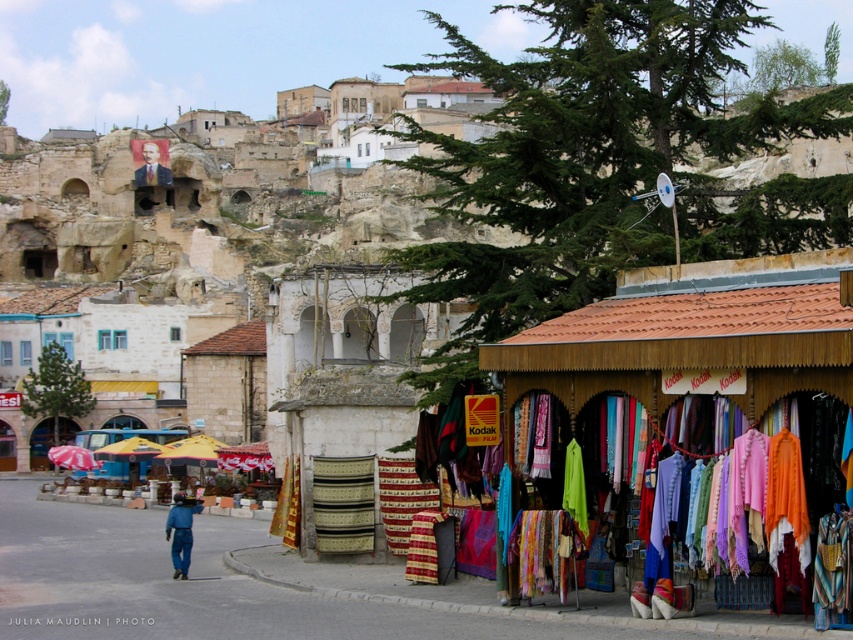
Question: Is the position of wooden stall at center more distant than that of blue denim pants at lower left?

Choices:
 (A) yes
 (B) no

Answer: (B)

Question: Estimate the real-world distances between objects in this image. Which object is closer to the wooden stall at center?

Choices:
 (A) blue denim pants at lower left
 (B) smooth brown suit at upper left

Answer: (A)

Question: Which of the following is the farthest from the observer?

Choices:
 (A) (143, 173)
 (B) (616, 324)
 (C) (189, 522)

Answer: (A)

Question: Which object is positioned farthest from the wooden stall at center?

Choices:
 (A) smooth brown suit at upper left
 (B) blue denim pants at lower left

Answer: (A)

Question: Is wooden stall at center in front of blue denim pants at lower left?

Choices:
 (A) no
 (B) yes

Answer: (B)

Question: In this image, where is wooden stall at center located relative to blue denim pants at lower left?

Choices:
 (A) below
 (B) above

Answer: (B)